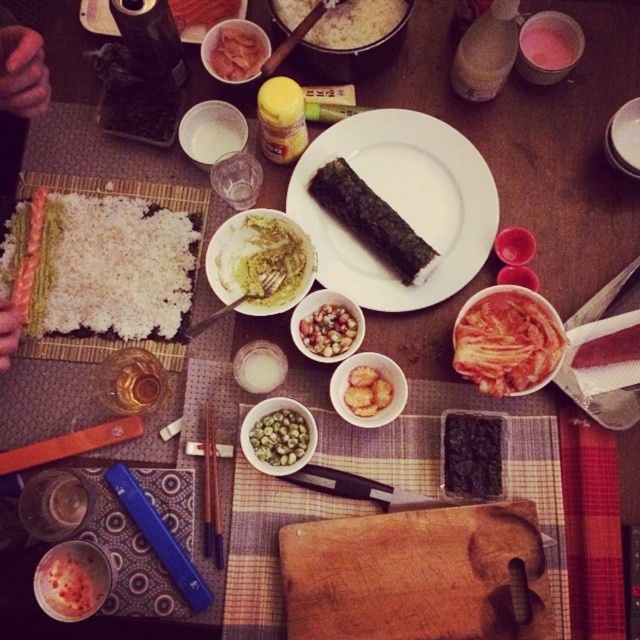
Question: Can you confirm if white rice at center is positioned to the right of bright red jelly at lower left?

Choices:
 (A) no
 (B) yes

Answer: (B)

Question: Estimate the real-world distances between objects in this image. Which object is farther from the white rice at center?

Choices:
 (A) yellow creamy rice at center
 (B) bright red jelly at lower left
 (C) smooth pinkish-red fish at center

Answer: (B)

Question: Estimate the real-world distances between objects in this image. Which object is closer to the smooth white plate at center?

Choices:
 (A) smooth pinkish-red fish at center
 (B) green matte rice ball at center
 (C) golden crispy fried at center

Answer: (B)

Question: Which object appears closest to the camera in this image?

Choices:
 (A) yellow creamy rice at center
 (B) pink translucent kimchi at upper center

Answer: (A)

Question: Is bright red kimchi at center right positioned before yellow creamy rice at center?

Choices:
 (A) no
 (B) yes

Answer: (B)

Question: In this image, where is green matte rice ball at center located relative to wooden chopsticks at center?

Choices:
 (A) above
 (B) below

Answer: (A)